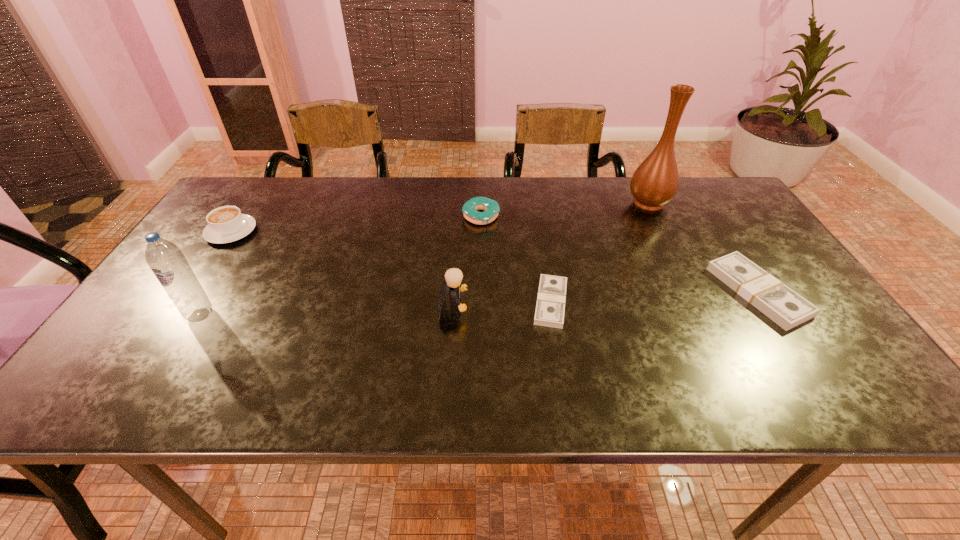
The width and height of the screenshot is (960, 540). I want to click on vacant space at the far right corner of the desktop, so click(690, 206).

In the image, there is a desktop. Where is `vacant space at the near right corner`? vacant space at the near right corner is located at coordinates (836, 352).

Locate an element on the screen. vacant region between the doughnut and the sixth shortest object is located at coordinates (341, 266).

The width and height of the screenshot is (960, 540). I want to click on free space that is in between the water bottle and the vase, so click(424, 259).

Where is `free area in between the sixth shortest object and the right dollar`? The width and height of the screenshot is (960, 540). free area in between the sixth shortest object and the right dollar is located at coordinates (479, 303).

Find the location of a particular element. This screenshot has width=960, height=540. free space that is in between the sixth shortest object and the taller dollar is located at coordinates (479, 303).

Where is `free space between the third tallest object and the right dollar`? Image resolution: width=960 pixels, height=540 pixels. free space between the third tallest object and the right dollar is located at coordinates (605, 299).

Locate an element on the screen. free space between the doughnut and the right dollar is located at coordinates (619, 254).

At what (x,y) coordinates should I click in order to perform the action: click on free area in between the fifth tallest object and the fourth tallest object. Please return your answer as a coordinate pair (x, y). This screenshot has width=960, height=540. Looking at the image, I should click on (356, 224).

Find the location of a particular element. This screenshot has height=540, width=960. free space between the fifth shortest object and the right dollar is located at coordinates (605, 299).